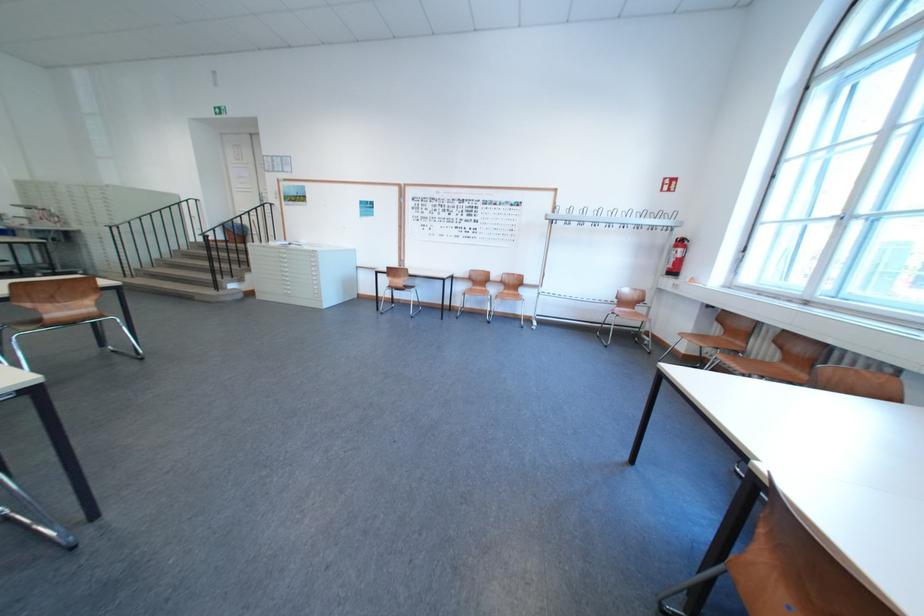
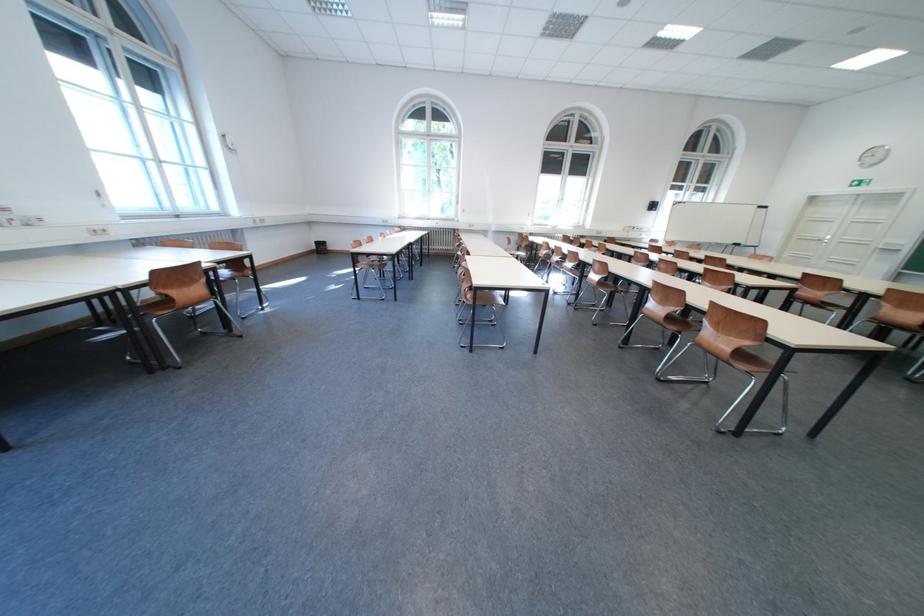
The point at [106,310] is marked in the first image. Where is the corresponding point in the second image?

(744, 352)